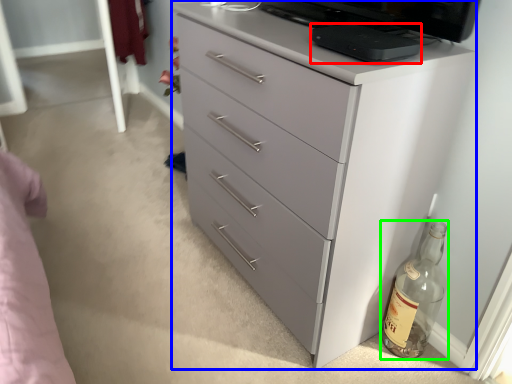
Question: Which object is positioned closest to appliance (highlighted by a red box)? Select from chest of drawers (highlighted by a blue box) and bottle (highlighted by a green box).

Choices:
 (A) chest of drawers
 (B) bottle

Answer: (A)